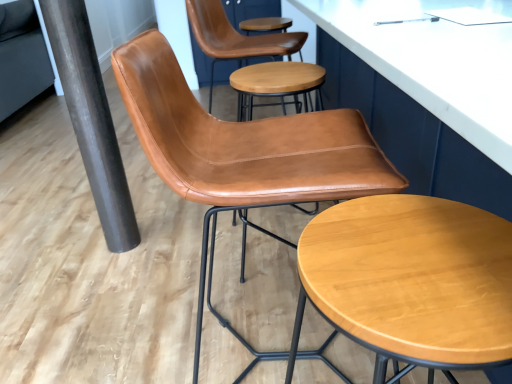
Question: From the image's perspective, is black metallic pole at lower left located above cognac leather chair at center?

Choices:
 (A) yes
 (B) no

Answer: (A)

Question: From a real-world perspective, is black metallic pole at lower left physically below cognac leather chair at center?

Choices:
 (A) yes
 (B) no

Answer: (B)

Question: Considering the relative sizes of black metallic pole at lower left and cognac leather chair at center in the image provided, is black metallic pole at lower left taller than cognac leather chair at center?

Choices:
 (A) no
 (B) yes

Answer: (B)

Question: Considering the relative sizes of black metallic pole at lower left and cognac leather chair at center in the image provided, is black metallic pole at lower left thinner than cognac leather chair at center?

Choices:
 (A) yes
 (B) no

Answer: (A)

Question: Is black metallic pole at lower left beside cognac leather chair at center?

Choices:
 (A) yes
 (B) no

Answer: (B)

Question: Considering the relative sizes of black metallic pole at lower left and cognac leather chair at center in the image provided, is black metallic pole at lower left bigger than cognac leather chair at center?

Choices:
 (A) no
 (B) yes

Answer: (A)

Question: Is cognac leather chair at center positioned behind light brown wood stool at center?

Choices:
 (A) no
 (B) yes

Answer: (B)

Question: Is light brown wood stool at center inside cognac leather chair at center?

Choices:
 (A) yes
 (B) no

Answer: (B)

Question: Can you confirm if cognac leather chair at center is smaller than light brown wood stool at center?

Choices:
 (A) yes
 (B) no

Answer: (B)

Question: Considering the relative sizes of cognac leather chair at center and light brown wood stool at center in the image provided, is cognac leather chair at center bigger than light brown wood stool at center?

Choices:
 (A) no
 (B) yes

Answer: (B)

Question: From a real-world perspective, is cognac leather chair at center physically below light brown wood stool at center?

Choices:
 (A) no
 (B) yes

Answer: (A)

Question: Can you confirm if cognac leather chair at center is taller than light brown wood stool at center?

Choices:
 (A) no
 (B) yes

Answer: (B)

Question: Does light brown wood stool at center have a smaller size compared to cognac leather chair at center?

Choices:
 (A) no
 (B) yes

Answer: (B)